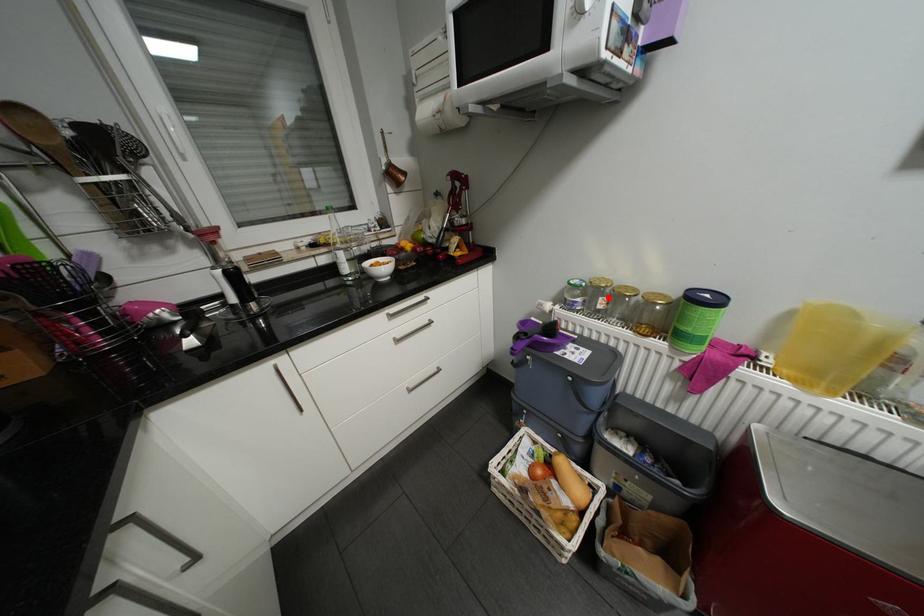
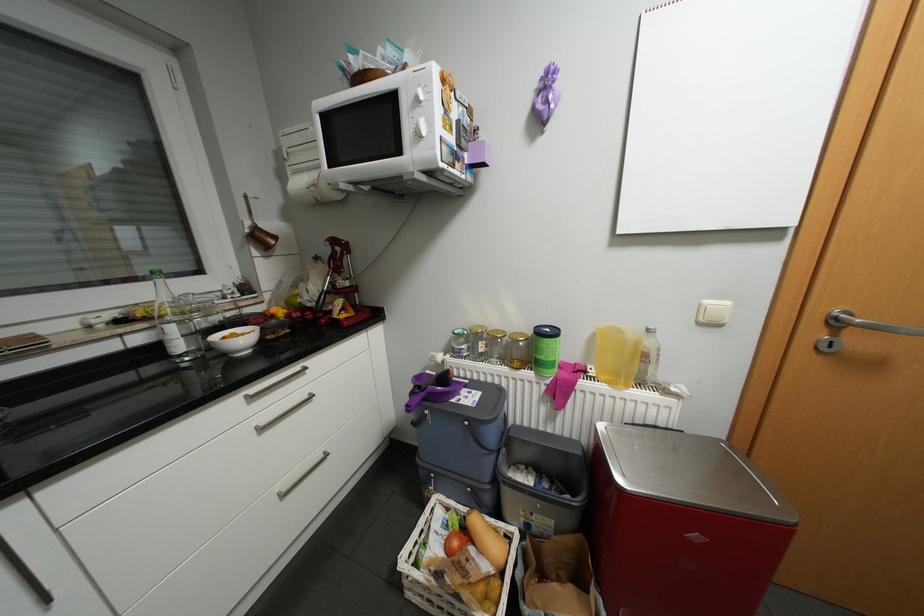
Find the pixel in the second image that matches the highlighted location in the first image.

(488, 342)